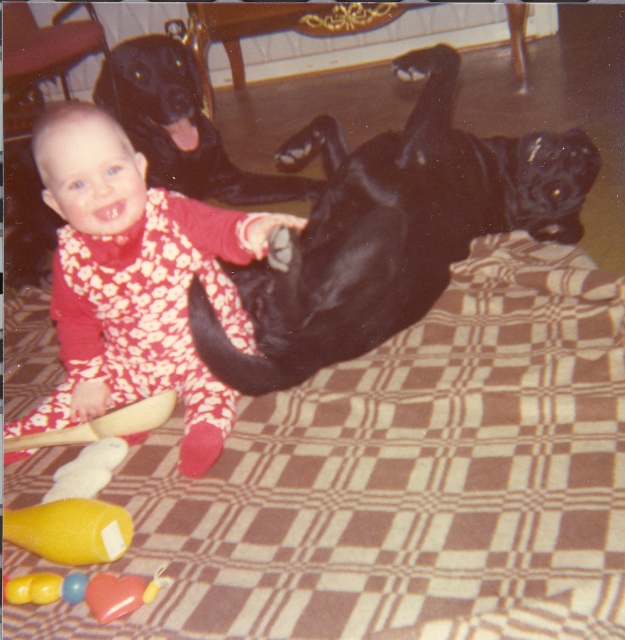
Identify the location of yellow rubber rattle at lower left. (71, 531).

Based on the photo, does yellow rubber rattle at lower left have a greater height compared to rubberized plastic rattle at lower left?

Yes.

Is point (21, 509) positioned before point (46, 588)?

That is False.

Where is `yellow rubber rattle at lower left`? The width and height of the screenshot is (625, 640). yellow rubber rattle at lower left is located at coordinates (71, 531).

Between floral fabric toddler at center and rubber heart-shaped toy at lower left, which one is positioned higher?

Positioned higher is floral fabric toddler at center.

Does floral fabric toddler at center have a lesser height compared to rubber heart-shaped toy at lower left?

Incorrect, floral fabric toddler at center's height does not fall short of rubber heart-shaped toy at lower left's.

Does point (206, 273) come behind point (11, 589)?

Yes, point (206, 273) is farther from viewer.

The width and height of the screenshot is (625, 640). In order to click on floral fabric toddler at center in this screenshot , I will do `click(136, 282)`.

Is shiny black dog at center wider than shiny black dog at upper center?

Yes, shiny black dog at center is wider than shiny black dog at upper center.

Does shiny black dog at center appear under shiny black dog at upper center?

Correct, shiny black dog at center is located below shiny black dog at upper center.

The height and width of the screenshot is (640, 625). I want to click on shiny black dog at center, so click(x=391, y=230).

This screenshot has height=640, width=625. Identify the location of shiny black dog at center. (391, 230).